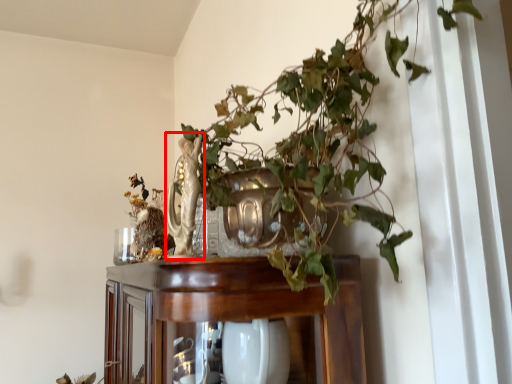
Question: From the image's perspective, what is the correct spatial positioning of sculpture (annotated by the red box) in reference to furniture?

Choices:
 (A) above
 (B) below

Answer: (A)